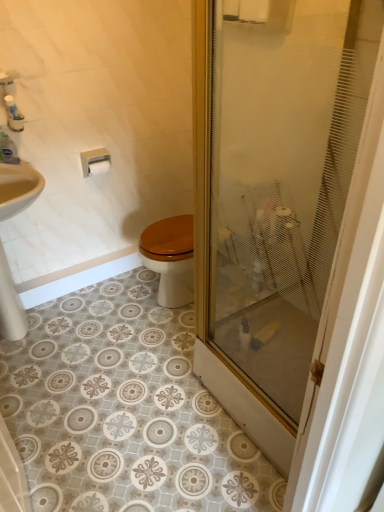
Question: From the image's perspective, is white matte toilet paper at upper left on white plastic toilet paper holder at upper left?

Choices:
 (A) no
 (B) yes

Answer: (A)

Question: From a real-world perspective, is white matte toilet paper at upper left positioned over white plastic toilet paper holder at upper left based on gravity?

Choices:
 (A) no
 (B) yes

Answer: (A)

Question: Considering the relative sizes of white matte toilet paper at upper left and white plastic toilet paper holder at upper left in the image provided, is white matte toilet paper at upper left shorter than white plastic toilet paper holder at upper left?

Choices:
 (A) no
 (B) yes

Answer: (B)

Question: Considering the relative positions of white matte toilet paper at upper left and white plastic toilet paper holder at upper left in the image provided, is white matte toilet paper at upper left to the left of white plastic toilet paper holder at upper left from the viewer's perspective?

Choices:
 (A) yes
 (B) no

Answer: (B)

Question: Are white matte toilet paper at upper left and white plastic toilet paper holder at upper left located far from each other?

Choices:
 (A) no
 (B) yes

Answer: (A)

Question: Based on their positions, is transparent frosted glass at center located to the left or right of clear plastic bottle at upper left?

Choices:
 (A) right
 (B) left

Answer: (A)

Question: Considering their positions, is transparent frosted glass at center located in front of or behind clear plastic bottle at upper left?

Choices:
 (A) front
 (B) behind

Answer: (A)

Question: In terms of height, does transparent frosted glass at center look taller or shorter compared to clear plastic bottle at upper left?

Choices:
 (A) short
 (B) tall

Answer: (B)

Question: From the image's perspective, is transparent frosted glass at center above or below clear plastic bottle at upper left?

Choices:
 (A) above
 (B) below

Answer: (B)

Question: From a real-world perspective, is transparent frosted glass at center physically located above or below white matte toilet paper at upper left?

Choices:
 (A) above
 (B) below

Answer: (A)

Question: In terms of size, does transparent frosted glass at center appear bigger or smaller than white matte toilet paper at upper left?

Choices:
 (A) big
 (B) small

Answer: (A)

Question: From their relative heights in the image, would you say transparent frosted glass at center is taller or shorter than white matte toilet paper at upper left?

Choices:
 (A) tall
 (B) short

Answer: (A)

Question: Is point (261, 106) positioned closer to the camera than point (96, 170)?

Choices:
 (A) closer
 (B) farther

Answer: (A)

Question: Based on their sizes in the image, would you say white plastic toilet paper holder at upper left is bigger or smaller than white matte toilet paper at upper left?

Choices:
 (A) big
 (B) small

Answer: (A)

Question: Based on their positions, is white plastic toilet paper holder at upper left located to the left or right of white matte toilet paper at upper left?

Choices:
 (A) left
 (B) right

Answer: (A)